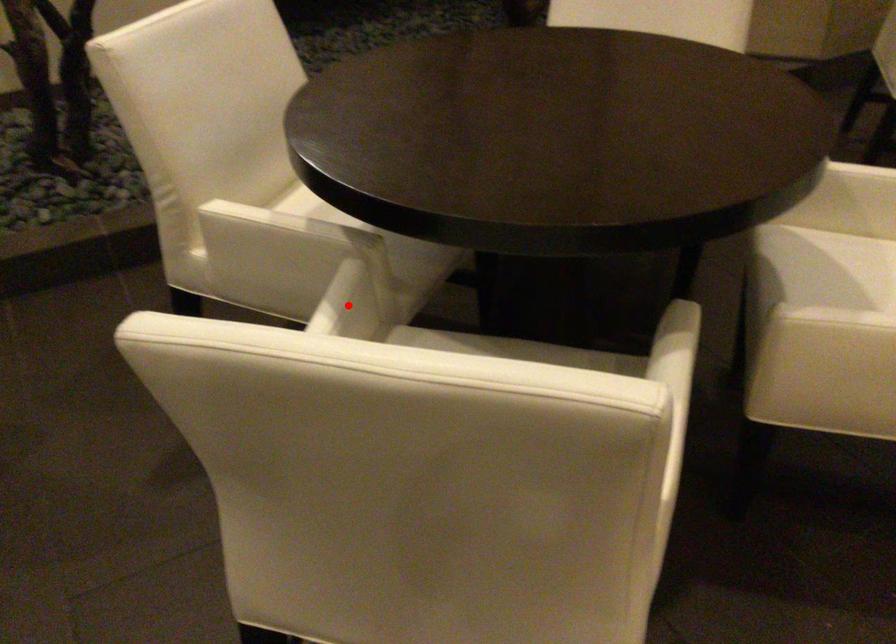
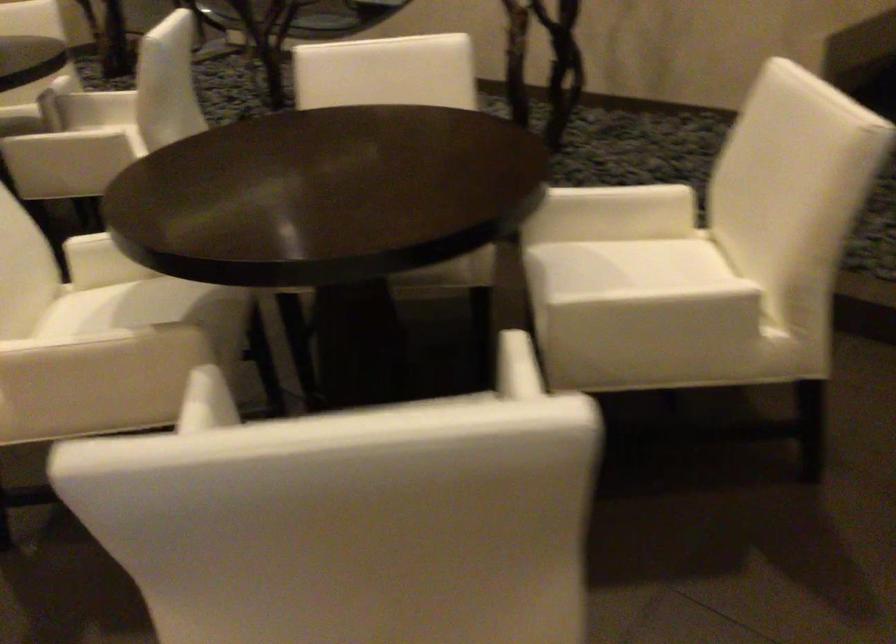
Question: I am providing you with two images of the same scene from different viewpoints. A red point is marked on the first image. Is the red point's position out of view in image 2?

Choices:
 (A) Yes
 (B) No

Answer: (A)